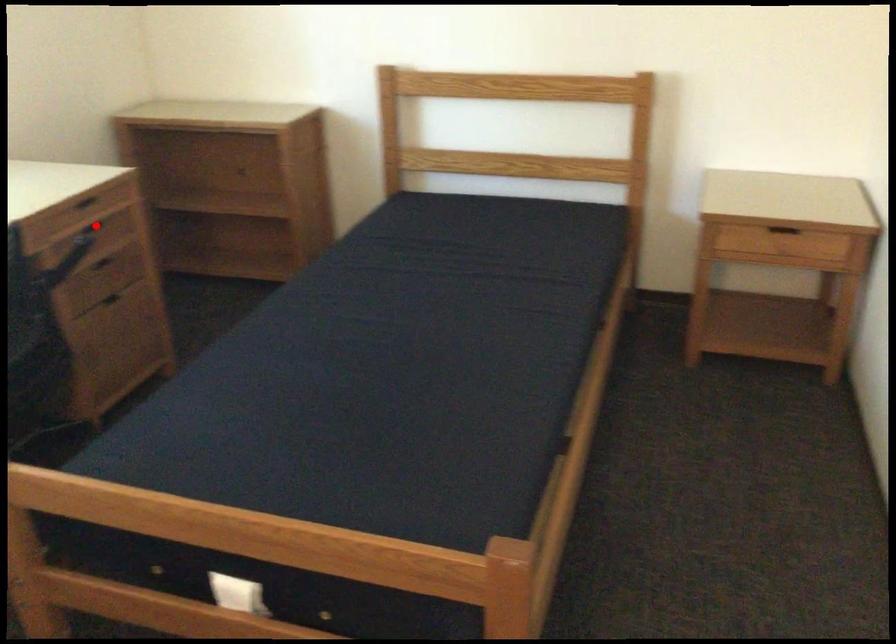
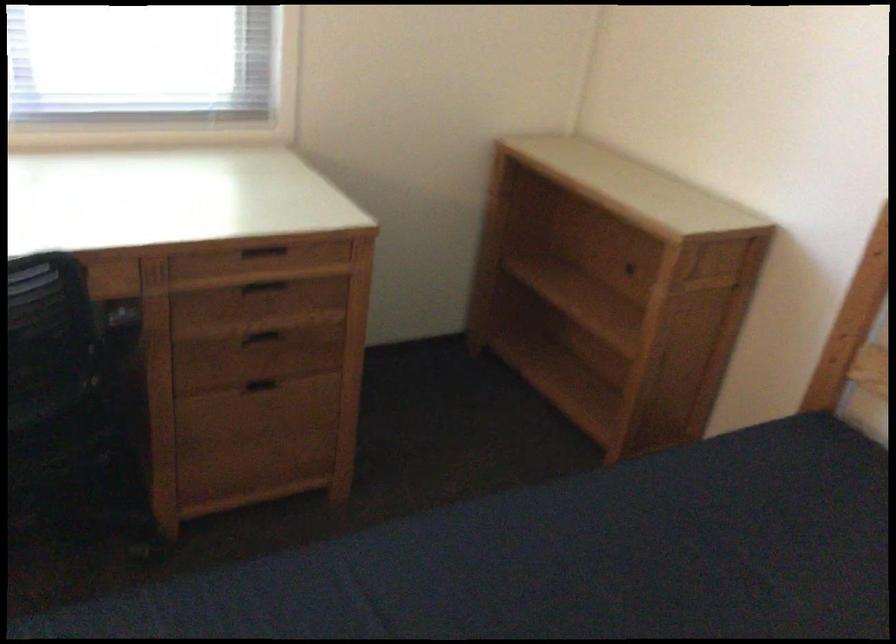
In the second image, find the point that corresponds to the highlighted location in the first image.

(263, 285)